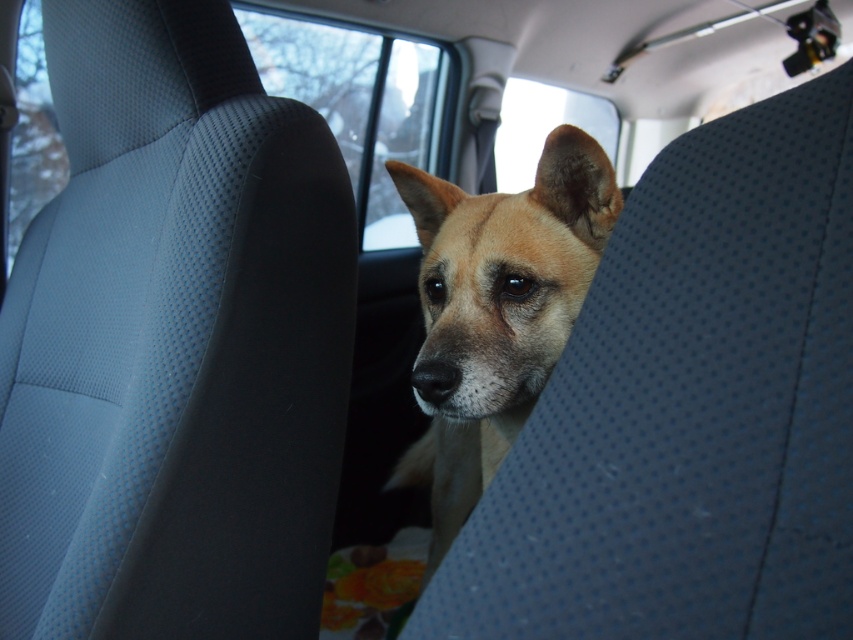
Question: Which point is closer to the camera?

Choices:
 (A) light brown fur dog at center
 (B) transparent glass window at upper center

Answer: (A)

Question: Does light brown fur dog at center come behind transparent glass window at upper center?

Choices:
 (A) yes
 (B) no

Answer: (B)

Question: Which of the following is the farthest from the observer?

Choices:
 (A) transparent glass window at upper center
 (B) light brown fur dog at center

Answer: (A)

Question: Can you confirm if light brown fur dog at center is positioned above transparent glass window at upper center?

Choices:
 (A) no
 (B) yes

Answer: (A)

Question: Does light brown fur dog at center have a smaller size compared to transparent glass window at upper center?

Choices:
 (A) yes
 (B) no

Answer: (A)